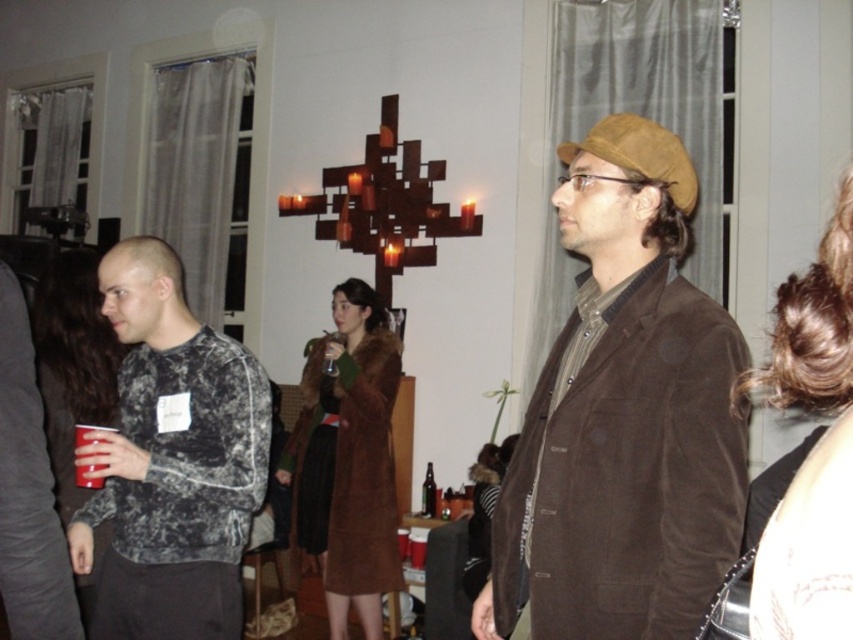
This screenshot has height=640, width=853. Describe the element at coordinates (171, 460) in the screenshot. I see `black speckled sweater at left` at that location.

Looking at this image, does black speckled sweater at left appear over brown glass bottle at center?

Yes, black speckled sweater at left is above brown glass bottle at center.

Describe the element at coordinates (171, 460) in the screenshot. I see `black speckled sweater at left` at that location.

The height and width of the screenshot is (640, 853). Find the location of `black speckled sweater at left`. black speckled sweater at left is located at coordinates (171, 460).

At what (x,y) coordinates should I click in order to perform the action: click on black speckled sweater at left. Please return your answer as a coordinate pair (x, y). Looking at the image, I should click on (171, 460).

Between black speckled sweater at left and matte plastic cup at lower left, which one appears on the right side from the viewer's perspective?

Positioned to the right is black speckled sweater at left.

Is point (225, 387) positioned after point (74, 467)?

No, it is in front of (74, 467).

Find the location of a particular element. black speckled sweater at left is located at coordinates (171, 460).

Who is positioned more to the left, brown suede jacket at center or dark brown hair at right?

brown suede jacket at center

Who is positioned more to the right, brown suede jacket at center or dark brown hair at right?

From the viewer's perspective, dark brown hair at right appears more on the right side.

Which is behind, point (566, 560) or point (778, 605)?

Point (566, 560)

Where is `brown suede jacket at center`? brown suede jacket at center is located at coordinates (624, 417).